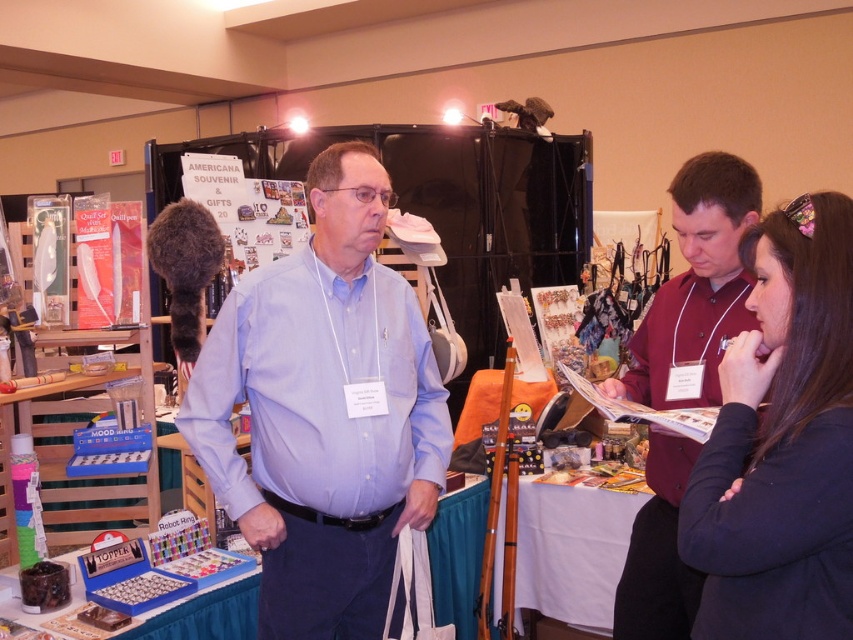
Question: Among these objects, which one is farthest from the camera?

Choices:
 (A) dark blue sweater at center
 (B) light blue shirt at center

Answer: (B)

Question: Can you confirm if light blue shirt at center is positioned above maroon button-up shirt at center?

Choices:
 (A) yes
 (B) no

Answer: (A)

Question: Among these points, which one is farthest from the camera?

Choices:
 (A) (665, 552)
 (B) (238, 516)
 (C) (770, 344)

Answer: (A)

Question: Which point is farther to the camera?

Choices:
 (A) dark blue sweater at center
 (B) light blue shirt at center

Answer: (B)

Question: Is light blue shirt at center above maroon button-up shirt at center?

Choices:
 (A) yes
 (B) no

Answer: (A)

Question: Can you confirm if light blue shirt at center is wider than dark blue sweater at center?

Choices:
 (A) no
 (B) yes

Answer: (B)